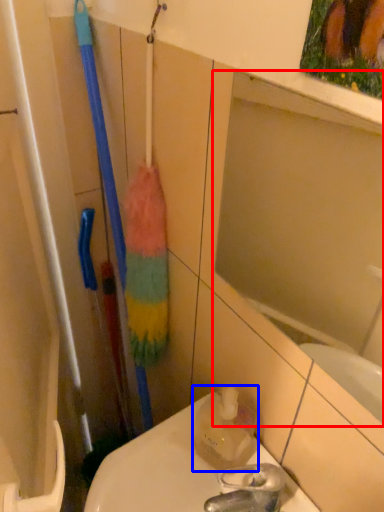
Question: Which of the following is the closest to the observer, mirror (highlighted by a red box) or cleaning product (highlighted by a blue box)?

Choices:
 (A) mirror
 (B) cleaning product

Answer: (A)